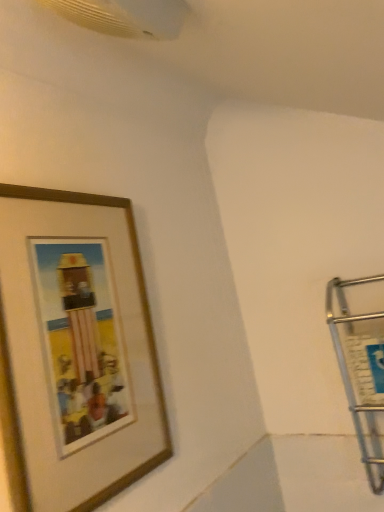
Question: Would you say wooden picture frame at upper left is to the left or to the right of satin silver cart at right in the picture?

Choices:
 (A) left
 (B) right

Answer: (A)

Question: Would you say wooden picture frame at upper left is inside or outside satin silver cart at right?

Choices:
 (A) outside
 (B) inside

Answer: (A)

Question: From a real-world perspective, is wooden picture frame at upper left physically located above or below satin silver cart at right?

Choices:
 (A) below
 (B) above

Answer: (B)

Question: Is satin silver cart at right inside or outside of wooden picture frame at upper left?

Choices:
 (A) inside
 (B) outside

Answer: (B)

Question: Is satin silver cart at right bigger or smaller than wooden picture frame at upper left?

Choices:
 (A) big
 (B) small

Answer: (A)

Question: From the image's perspective, is satin silver cart at right positioned above or below wooden picture frame at upper left?

Choices:
 (A) above
 (B) below

Answer: (B)

Question: From a real-world perspective, is satin silver cart at right above or below wooden picture frame at upper left?

Choices:
 (A) above
 (B) below

Answer: (B)